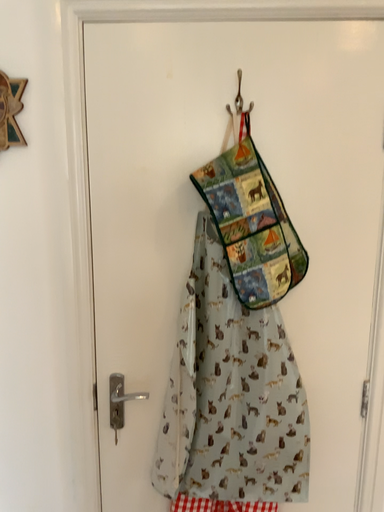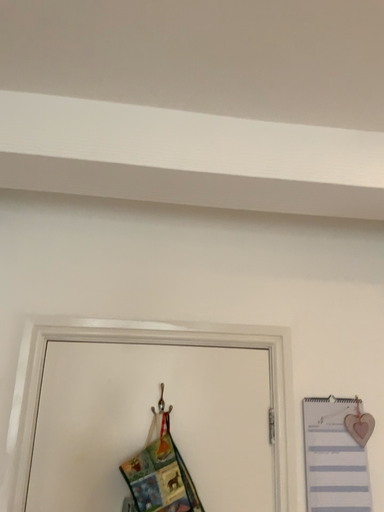
Question: Which way did the camera rotate in the video?

Choices:
 (A) rotated right
 (B) rotated left

Answer: (A)